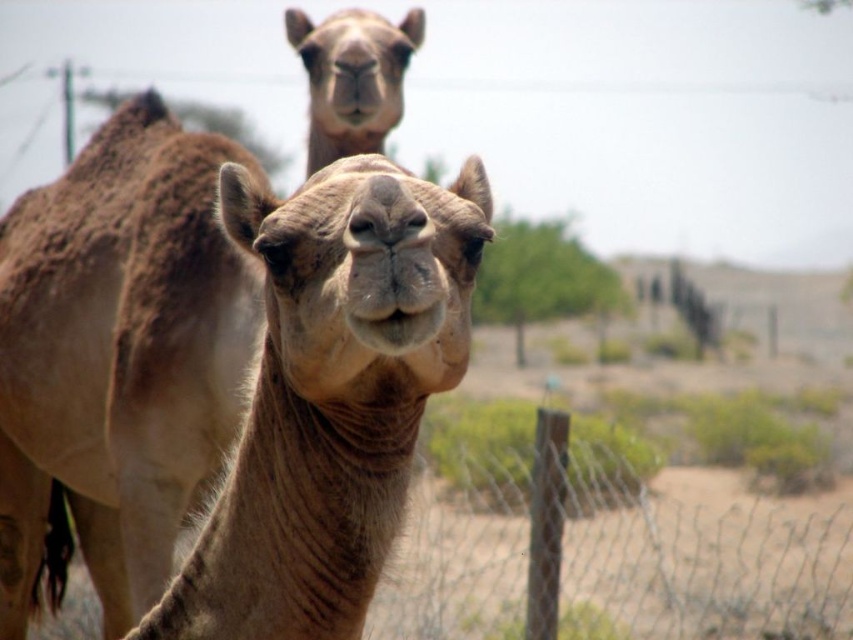
Is point (88, 564) closer to viewer compared to point (436, 470)?

Yes, point (88, 564) is closer to viewer.

Is brown textured camel at center above wire mesh at lower right?

Yes, brown textured camel at center is above wire mesh at lower right.

You are a GUI agent. You are given a task and a screenshot of the screen. Output one action in this format:
    pyautogui.click(x=<x>, y=<y>)
    Task: Click on the brown textured camel at center
    This screenshot has height=640, width=853.
    Given the screenshot: What is the action you would take?
    pyautogui.click(x=115, y=360)